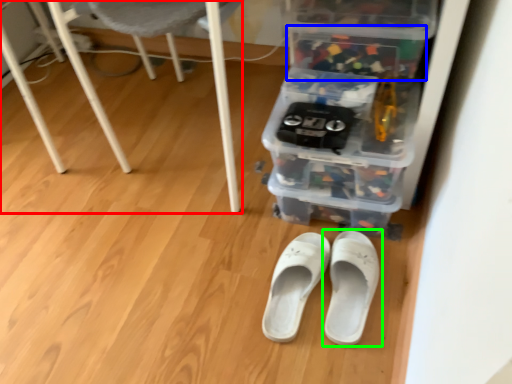
Question: Which is nearer to the furniture (highlighted by a red box)? storage box (highlighted by a blue box) or footwear (highlighted by a green box).

Choices:
 (A) storage box
 (B) footwear

Answer: (A)